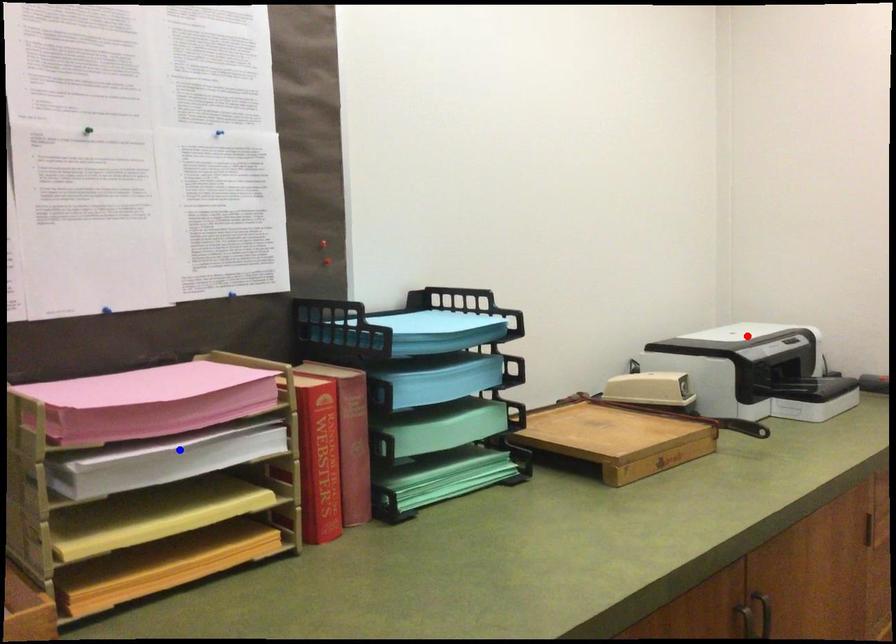
Question: Two points are marked on the image. Which point is closer to the camera?

Choices:
 (A) Blue point is closer.
 (B) Red point is closer.

Answer: (A)